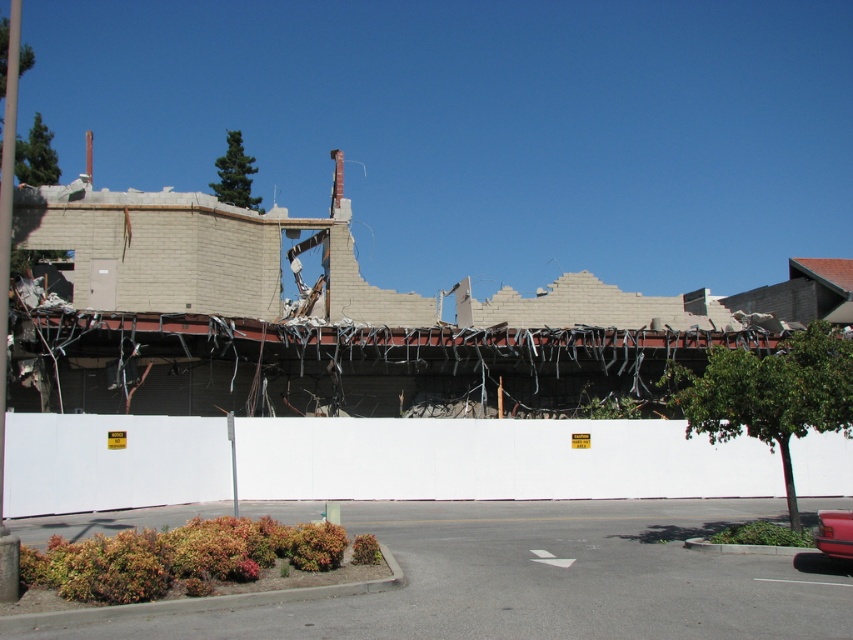
Which is more to the right, white plastic fence at center or metallic red car at lower right?

Positioned to the right is metallic red car at lower right.

Does point (114, 502) come closer to viewer compared to point (839, 524)?

That is False.

The height and width of the screenshot is (640, 853). I want to click on white plastic fence at center, so click(492, 460).